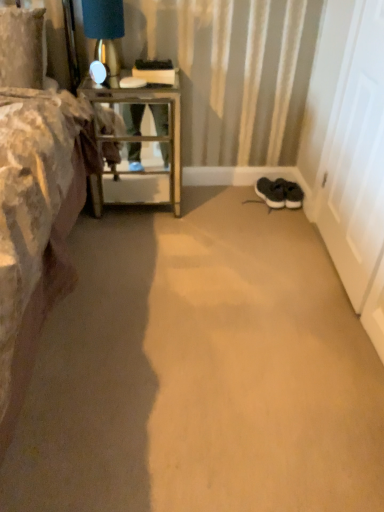
Question: Can you confirm if black suede sneakers at lower right is bigger than metallic glass table at left?

Choices:
 (A) yes
 (B) no

Answer: (B)

Question: From a real-world perspective, is black suede sneakers at lower right positioned over metallic glass table at left based on gravity?

Choices:
 (A) no
 (B) yes

Answer: (A)

Question: Is the position of black suede sneakers at lower right more distant than that of metallic glass table at left?

Choices:
 (A) no
 (B) yes

Answer: (B)

Question: Is metallic glass table at left surrounded by black suede sneakers at lower right?

Choices:
 (A) yes
 (B) no

Answer: (B)

Question: Is black suede sneakers at lower right wider than metallic glass table at left?

Choices:
 (A) no
 (B) yes

Answer: (A)

Question: From a real-world perspective, is metallic glass table at left above or below black suede sneakers at lower right?

Choices:
 (A) above
 (B) below

Answer: (A)

Question: Is metallic glass table at left in front of or behind black suede sneakers at lower right in the image?

Choices:
 (A) behind
 (B) front

Answer: (B)

Question: Is point (x=110, y=96) closer or farther from the camera than point (x=281, y=179)?

Choices:
 (A) farther
 (B) closer

Answer: (B)

Question: Is metallic glass table at left to the left or to the right of black suede sneakers at lower right in the image?

Choices:
 (A) right
 (B) left

Answer: (B)

Question: Is matte gold table lamp at upper left situated inside white matte door at right or outside?

Choices:
 (A) outside
 (B) inside

Answer: (A)

Question: From the image's perspective, is matte gold table lamp at upper left positioned above or below white matte door at right?

Choices:
 (A) above
 (B) below

Answer: (A)

Question: Looking at the image, does matte gold table lamp at upper left seem bigger or smaller compared to white matte door at right?

Choices:
 (A) small
 (B) big

Answer: (A)

Question: In terms of width, does matte gold table lamp at upper left look wider or thinner when compared to white matte door at right?

Choices:
 (A) thin
 (B) wide

Answer: (B)

Question: Would you say matte gold table lamp at upper left is inside or outside metallic glass table at left?

Choices:
 (A) outside
 (B) inside

Answer: (A)

Question: In the image, is matte gold table lamp at upper left positioned in front of or behind metallic glass table at left?

Choices:
 (A) front
 (B) behind

Answer: (A)